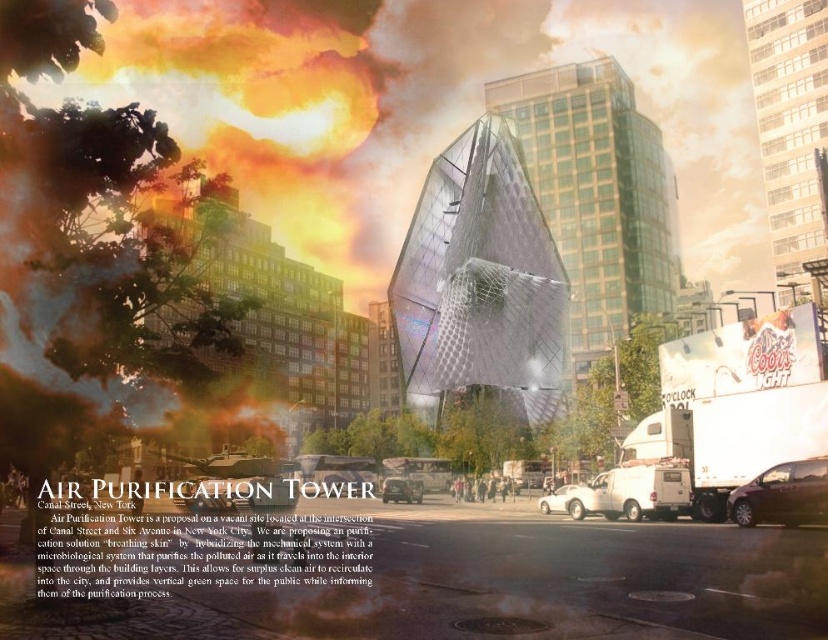
You are a delivery driver who needs to park your shiny silver minivan at lower right. There is a metallic silver car at center blocking the parking spot. Can you safely move your minivan into the spot without hitting the other car?

The shiny silver minivan at lower right is positioned over the metallic silver car at center, so you can safely move the shiny silver minivan at lower right into the parking spot without hitting the metallic silver car at center as it is already above it.

You are a delivery driver needing to park your truck between the shiny silver minivan at lower right and the white matte car at center. Your truck is 25 feet long. Can you fit your truck in the space between them?

The distance between the shiny silver minivan at lower right and the white matte car at center is 73.95 feet. Since your truck is only 25 feet long, there is more than enough space to park it between them.

You are a city planner analyzing the layout of the futuristic Air Purification Tower at Canal Street and Sixth Avenue. You notice a metallic silver car at center. Based on its position coordinates, can you determine if the car is closer to the tower or to the traditional high rises in the background?

The metallic silver car at center is located at point coordinates that place it closer to the traditional high rises in the background rather than the Air Purification Tower itself. Therefore, the car is nearer to the older buildings.